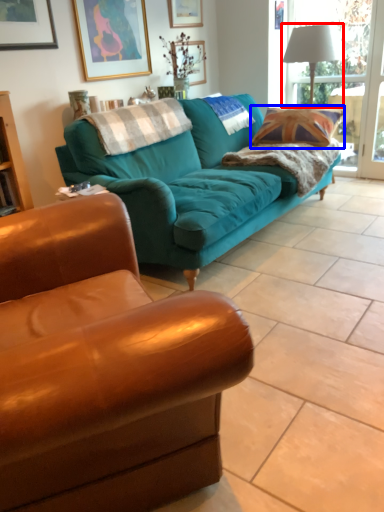
Question: Among these objects, which one is farthest to the camera, lamp (highlighted by a red box) or throw pillow (highlighted by a blue box)?

Choices:
 (A) lamp
 (B) throw pillow

Answer: (A)